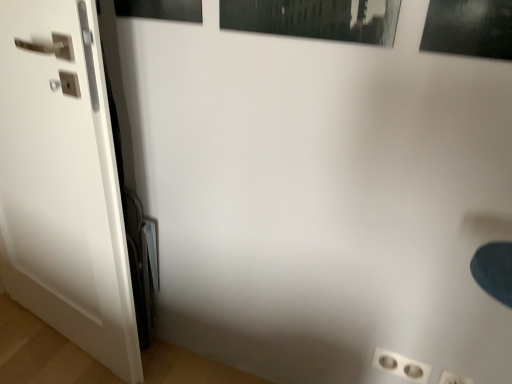
Image resolution: width=512 pixels, height=384 pixels. What do you see at coordinates (401, 366) in the screenshot?
I see `white plastic outlet at lower right` at bounding box center [401, 366].

Identify the location of matte black picture frame at upper left. point(161,9).

Relative to white glossy door at left, is matte black picture frame at upper left in front or behind?

matte black picture frame at upper left is behind white glossy door at left.

From the image's perspective, who appears lower, matte black picture frame at upper left or white glossy door at left?

white glossy door at left appears lower in the image.

This screenshot has height=384, width=512. Find the location of `picture frame lying above the white glossy door at left (from the image's perspective)`. picture frame lying above the white glossy door at left (from the image's perspective) is located at coordinates (161, 9).

In terms of width, does matte black picture frame at upper left look wider or thinner when compared to white plastic outlet at lower right?

matte black picture frame at upper left is wider than white plastic outlet at lower right.

From the image's perspective, is matte black picture frame at upper left located above or below white plastic outlet at lower right?

From the image's perspective, matte black picture frame at upper left appears above white plastic outlet at lower right.

In terms of height, does matte black picture frame at upper left look taller or shorter compared to white plastic outlet at lower right?

Considering their sizes, matte black picture frame at upper left has more height than white plastic outlet at lower right.

From a real-world perspective, between matte black picture frame at upper left and white plastic outlet at lower right, who is vertically higher?

matte black picture frame at upper left.

Is white glossy door at left aimed at matte black picture frame at upper left?

No, white glossy door at left is not turned towards matte black picture frame at upper left.

Is white glossy door at left next to matte black picture frame at upper left and touching it?

No, white glossy door at left is not in contact with matte black picture frame at upper left.

Which of these two, white glossy door at left or matte black picture frame at upper left, is bigger?

white glossy door at left is bigger.

You are a GUI agent. You are given a task and a screenshot of the screen. Output one action in this format:
    pyautogui.click(x=<x>, y=<y>)
    Task: Click on the electric outlet behind the white glossy door at left
    This screenshot has height=384, width=512.
    Given the screenshot: What is the action you would take?
    pyautogui.click(x=401, y=366)

From the image's perspective, which is above, white glossy door at left or white plastic outlet at lower right?

white glossy door at left.

Are white glossy door at left and white plastic outlet at lower right beside each other?

No, white glossy door at left is not touching white plastic outlet at lower right.

From the picture: Are white plastic outlet at lower right and white glossy door at left beside each other?

No, white plastic outlet at lower right is not beside white glossy door at left.

Is white plastic outlet at lower right positioned with its back to white glossy door at left?

white plastic outlet at lower right does not have its back to white glossy door at left.

Looking at this image, choose the correct answer: Is white plastic outlet at lower right inside white glossy door at left or outside it?

white plastic outlet at lower right is outside white glossy door at left.

Identify the location of door on the left of white plastic outlet at lower right. This screenshot has width=512, height=384. (63, 182).

Is white plastic outlet at lower right inside or outside of matte black picture frame at upper left?

white plastic outlet at lower right is spatially situated outside matte black picture frame at upper left.

Looking at their sizes, would you say white plastic outlet at lower right is wider or thinner than matte black picture frame at upper left?

In the image, white plastic outlet at lower right appears to be more narrow than matte black picture frame at upper left.

Is white plastic outlet at lower right far from matte black picture frame at upper left?

Yes.

Measure the distance between white plastic outlet at lower right and matte black picture frame at upper left.

white plastic outlet at lower right is 3.61 feet from matte black picture frame at upper left.

Identify the location of picture frame that is above the white glossy door at left (from the image's perspective). The height and width of the screenshot is (384, 512). (161, 9).

The width and height of the screenshot is (512, 384). Find the location of `electric outlet located below the matte black picture frame at upper left (from the image's perspective)`. electric outlet located below the matte black picture frame at upper left (from the image's perspective) is located at coordinates (401, 366).

Considering their positions, is matte black picture frame at upper left positioned further to white plastic outlet at lower right than white glossy door at left?

The object further to white plastic outlet at lower right is matte black picture frame at upper left.

Which object lies further to the anchor point matte black picture frame at upper left, white plastic outlet at lower right or white glossy door at left?

Based on the image, white plastic outlet at lower right appears to be further to matte black picture frame at upper left.

In the scene shown: When comparing their distances from white plastic outlet at lower right, does white glossy door at left or matte black picture frame at upper left seem closer?

white glossy door at left is closer to white plastic outlet at lower right.

Looking at the image, which one is located further to white glossy door at left, white plastic outlet at lower right or matte black picture frame at upper left?

Among the two, white plastic outlet at lower right is located further to white glossy door at left.

Looking at the image, which one is located closer to matte black picture frame at upper left, white glossy door at left or white plastic outlet at lower right?

white glossy door at left.

Based on their spatial positions, is matte black picture frame at upper left or white plastic outlet at lower right further from white glossy door at left?

white plastic outlet at lower right.

You are a GUI agent. You are given a task and a screenshot of the screen. Output one action in this format:
    pyautogui.click(x=<x>, y=<y>)
    Task: Click on the picture frame between white glossy door at left and white plastic outlet at lower right in the horizontal direction
    
    Given the screenshot: What is the action you would take?
    pyautogui.click(x=161, y=9)